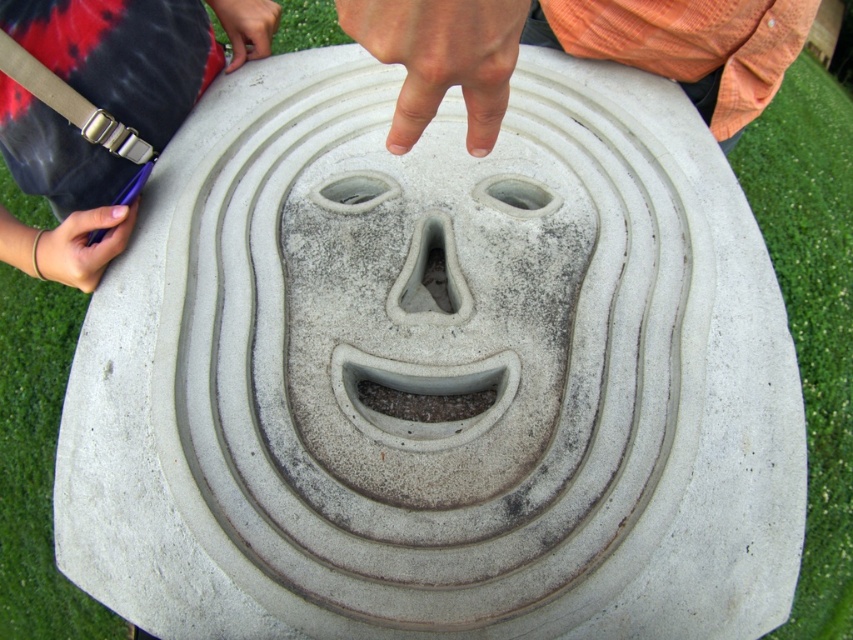
What is the exact 2D coordinate of the orange cotton shirt at upper center in the image?

The orange cotton shirt at upper center is located at the coordinate point of (578, 51).